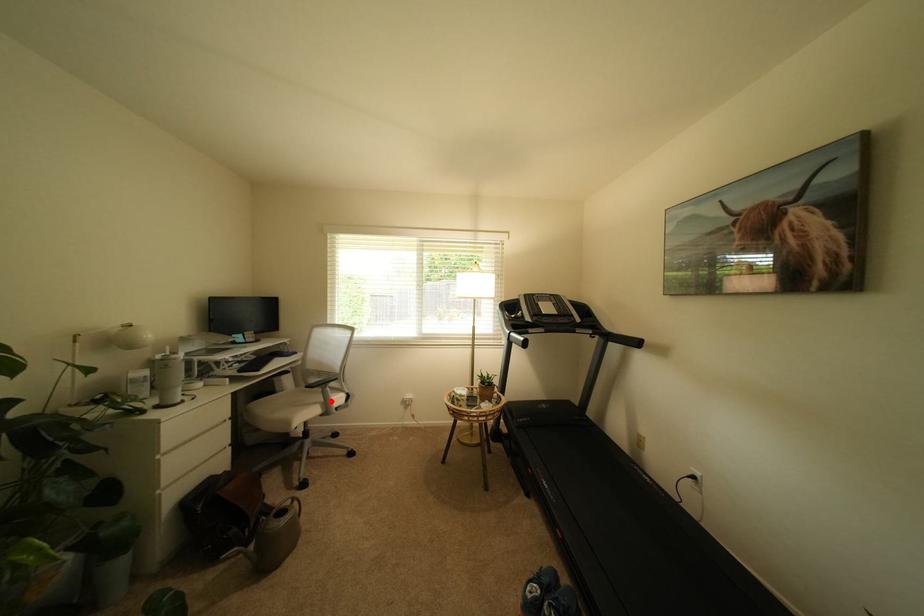
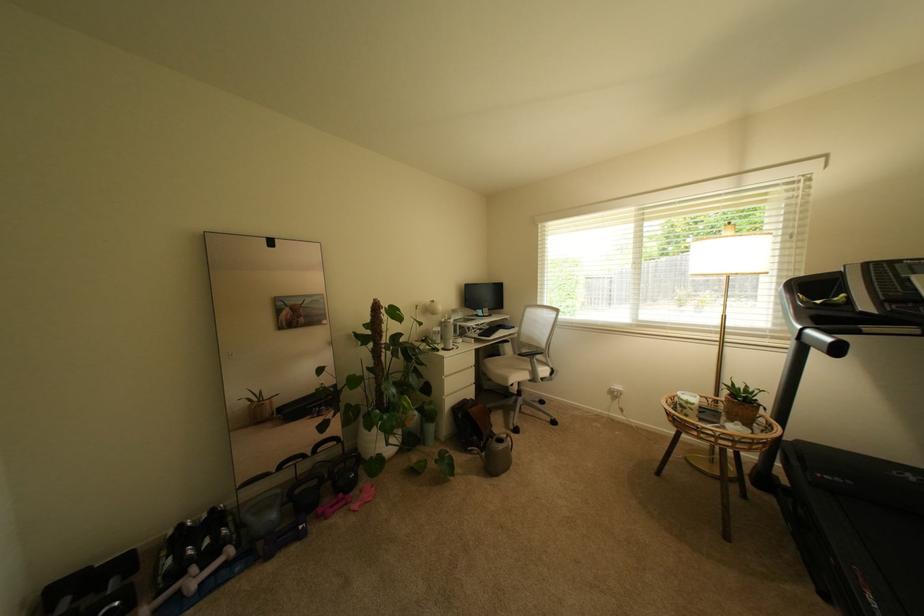
Question: I am providing you with two images of the same scene from different viewpoints. Given a red point in image1, look at the same physical point in image2. Is it:

Choices:
 (A) Closer to the viewpoint
 (B) Farther from the viewpoint

Answer: (B)